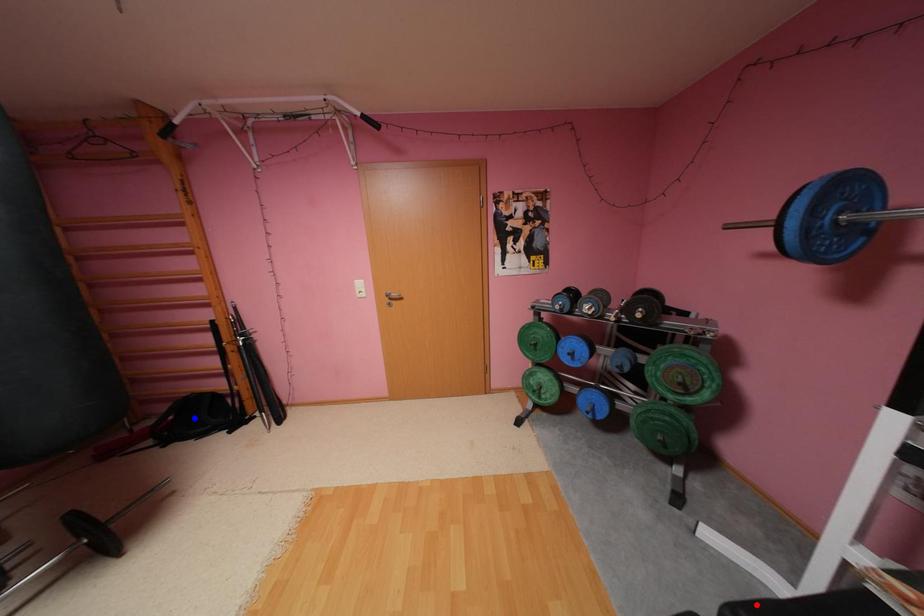
Question: In the image, two points are highlighted. Which point is nearer to the camera? Reply with the corresponding letter.

Choices:
 (A) blue point
 (B) red point

Answer: (B)